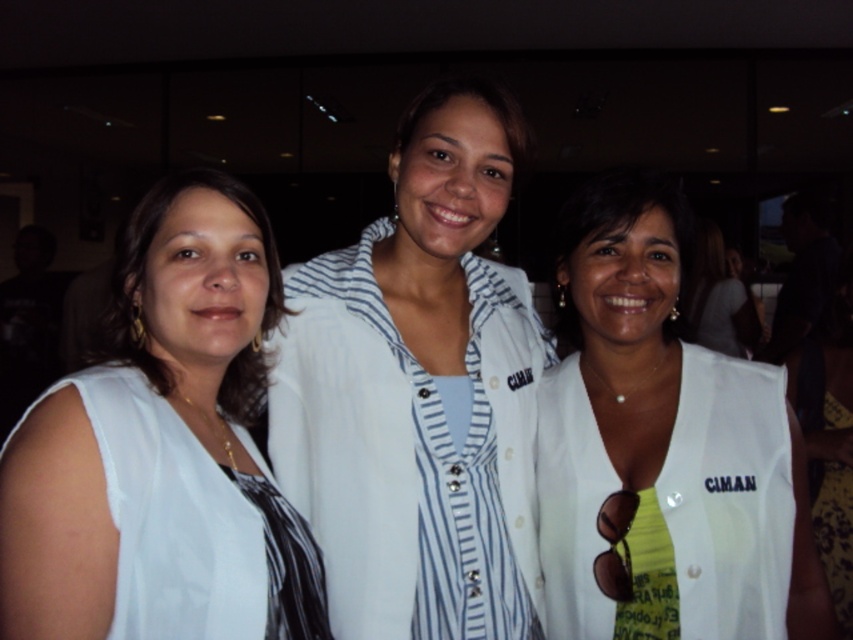
You are a photographer adjusting your camera settings to focus on the white matte vest at center and the white fabric at left. Which object should you focus on first to ensure it appears sharp in the photo?

The white matte vest at center should be focused on first because it is closer to the viewer than the white fabric at left, ensuring it will appear sharp.